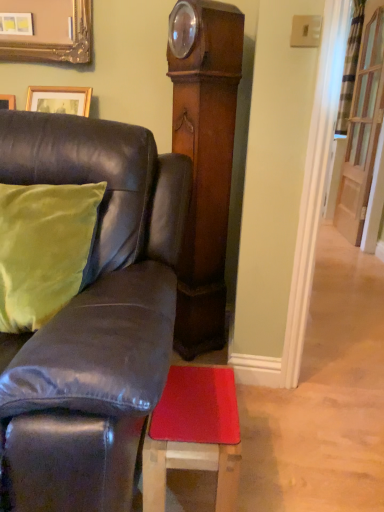
Question: Is green velvet pillow at left situated inside clear glass door at upper right or outside?

Choices:
 (A) inside
 (B) outside

Answer: (B)

Question: In terms of width, does green velvet pillow at left look wider or thinner when compared to clear glass door at upper right?

Choices:
 (A) wide
 (B) thin

Answer: (A)

Question: Estimate the real-world distances between objects in this image. Which object is closer to the wooden grandfather clock at center?

Choices:
 (A) green velvet pillow at left
 (B) rubberized red mat at lower center
 (C) clear glass door at upper right
 (D) leather couch at left

Answer: (D)

Question: Which object is positioned farthest from the clear glass door at upper right?

Choices:
 (A) green velvet pillow at left
 (B) wooden grandfather clock at center
 (C) leather couch at left
 (D) rubberized red mat at lower center

Answer: (A)